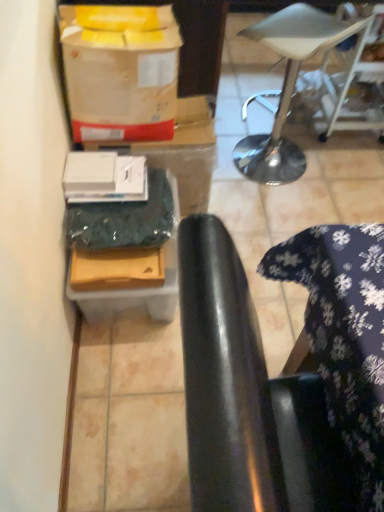
Question: Does point (345, 34) appear closer or farther from the camera than point (155, 42)?

Choices:
 (A) closer
 (B) farther

Answer: (B)

Question: Relative to matte cardboard wrapping paper at upper left, is white leather stool at upper right in front or behind?

Choices:
 (A) behind
 (B) front

Answer: (A)

Question: Which object is positioned closest to the matte cardboard wrapping paper at upper left?

Choices:
 (A) matte green cardboard box at lower left, acting as the 2th cardboard box starting from the front
 (B) white leather stool at upper right
 (C) black leather chair at lower right
 (D) matte brown cardboard box at lower left, positioned as the 2th cardboard box in back-to-front order

Answer: (A)

Question: Considering the real-world distances, which object is closest to the black leather chair at lower right?

Choices:
 (A) white leather stool at upper right
 (B) matte brown cardboard box at lower left, positioned as the 2th cardboard box in back-to-front order
 (C) matte green cardboard box at lower left, acting as the 2th cardboard box starting from the front
 (D) matte cardboard wrapping paper at upper left

Answer: (B)